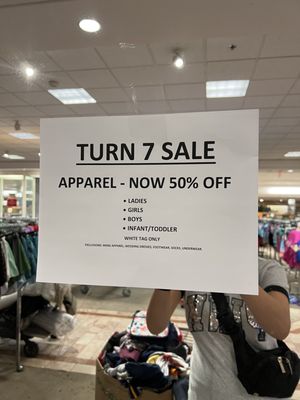
Find the location of a particular element. carpet is located at coordinates (104, 300), (73, 391).